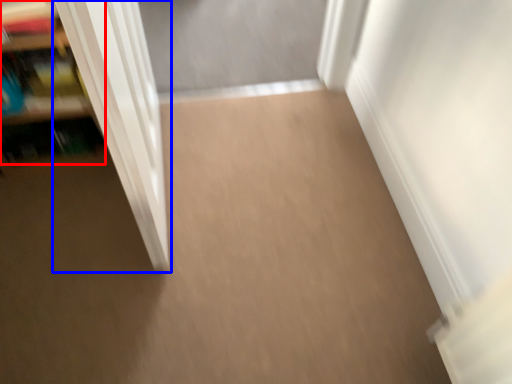
Question: Which object is closer to the camera taking this photo, shelf (highlighted by a red box) or door (highlighted by a blue box)?

Choices:
 (A) shelf
 (B) door

Answer: (B)